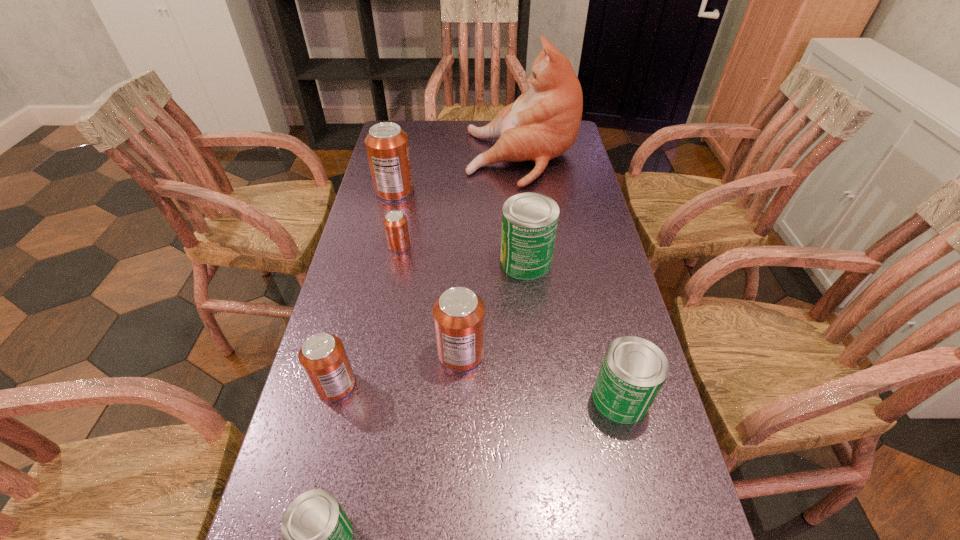
Locate an element on the screen. This screenshot has width=960, height=540. empty location between the rightmost green can and the smallest orange can is located at coordinates (510, 322).

Where is `free space that is in between the biggest green can and the second biggest orange can`? This screenshot has height=540, width=960. free space that is in between the biggest green can and the second biggest orange can is located at coordinates (493, 307).

You are a GUI agent. You are given a task and a screenshot of the screen. Output one action in this format:
    pyautogui.click(x=<x>, y=<y>)
    Task: Click on the sixth closest object to the third can from right to left
    The width and height of the screenshot is (960, 540).
    Given the screenshot: What is the action you would take?
    pyautogui.click(x=387, y=145)

Identify which object is the fourth nearest to the farthest green can. Please provide its 2D coordinates. Your answer should be formatted as a tuple, i.e. [(x, y)], where the tuple contains the x and y coordinates of a point satisfying the conditions above.

[(633, 370)]

Identify the location of the second closest can to the farthest green can. [395, 223].

Find the location of `can identified as the fifth closest to the orange cat`. can identified as the fifth closest to the orange cat is located at coordinates (633, 370).

This screenshot has width=960, height=540. I want to click on orange can that is the third nearest to the rightmost orange can, so click(x=387, y=145).

Identify the location of the closest orange can to the second farthest green can. (459, 314).

Select which green can is the second closest to the nearest object. Please provide its 2D coordinates. Your answer should be formatted as a tuple, i.e. [(x, y)], where the tuple contains the x and y coordinates of a point satisfying the conditions above.

[(529, 220)]

In order to click on green can that is the closest to the third nearest orange can in this screenshot , I will do `click(529, 220)`.